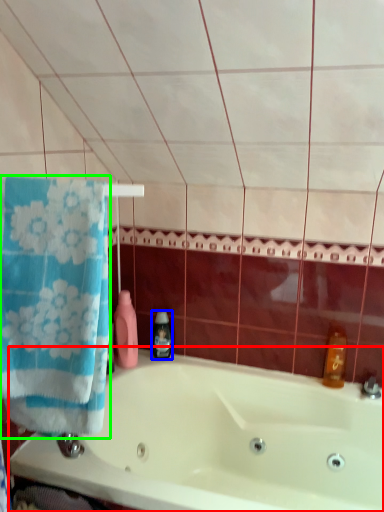
Question: Based on their relative distances, which object is nearer to bathtub (highlighted by a red box)? Choose from soap dispenser (highlighted by a blue box) and towel (highlighted by a green box).

Choices:
 (A) soap dispenser
 (B) towel

Answer: (A)